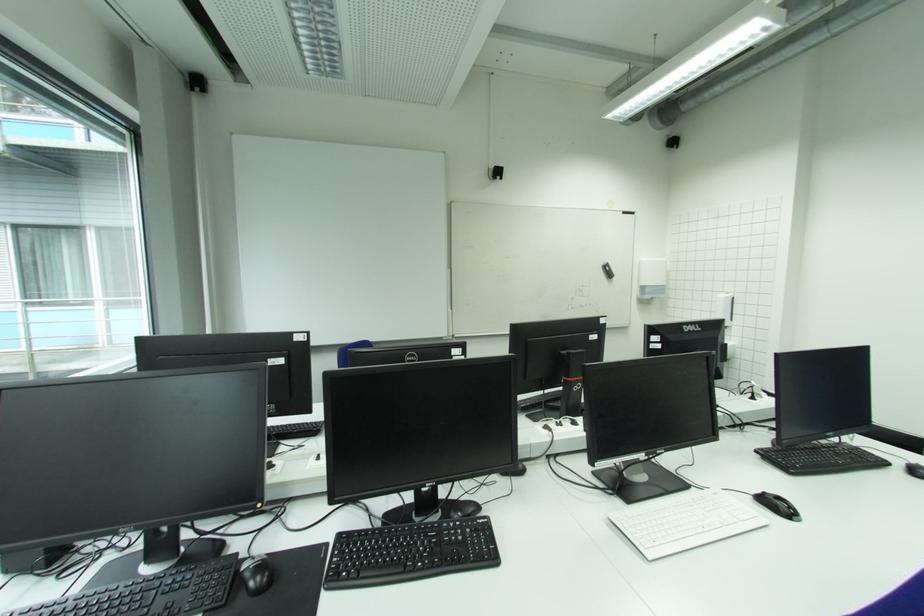
What do you see at coordinates (651, 272) in the screenshot?
I see `the sanitizer pump head` at bounding box center [651, 272].